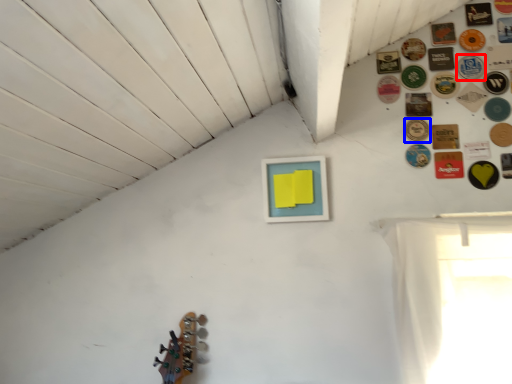
Question: Which object appears farthest to the camera in this image, button (highlighted by a red box) or button (highlighted by a blue box)?

Choices:
 (A) button
 (B) button

Answer: (A)